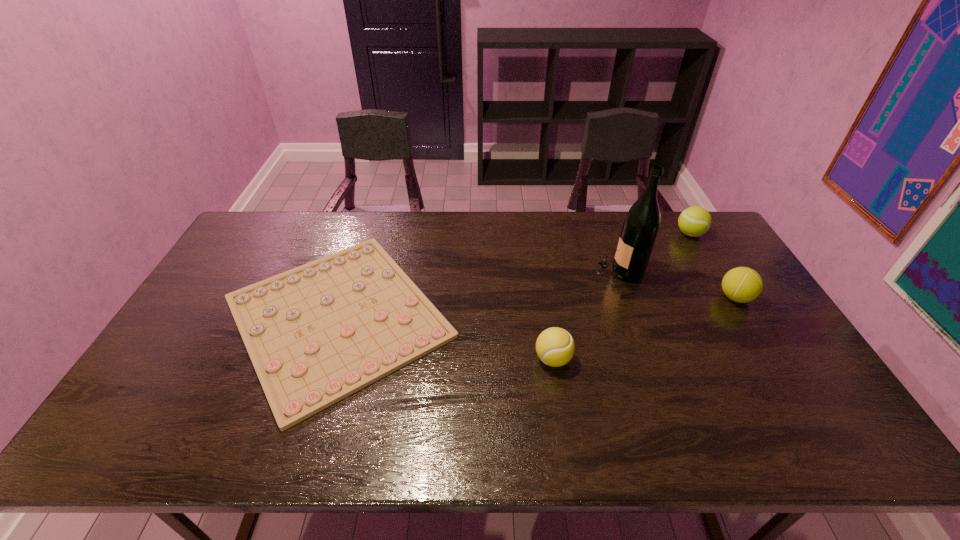
Where is `vacant area at the far edge of the desktop`? The height and width of the screenshot is (540, 960). vacant area at the far edge of the desktop is located at coordinates (668, 231).

Identify the location of vacant space at the near edge of the desktop. This screenshot has height=540, width=960. (361, 428).

Locate an element on the screen. free space at the right edge of the desktop is located at coordinates (709, 300).

At what (x,y) coordinates should I click in order to perform the action: click on free location at the far right corner. Please return your answer as a coordinate pair (x, y). This screenshot has width=960, height=540. Looking at the image, I should click on (704, 239).

Identify the location of free space between the farthest tennis ball and the leftmost tennis ball. (622, 296).

I want to click on free spot between the fourth object from right to left and the third object from right to left, so click(x=587, y=314).

Find the location of `free space between the leftmost tennis ball and the farthest tennis ball`. free space between the leftmost tennis ball and the farthest tennis ball is located at coordinates tap(622, 296).

Identify the location of vacant area that lies between the leftmost tennis ball and the third object from left to right. Image resolution: width=960 pixels, height=540 pixels. (587, 314).

I want to click on vacant area between the tallest object and the shortest object, so point(479,293).

Find the location of a particular element. vacant area that lies between the farthest tennis ball and the tallest object is located at coordinates (655, 252).